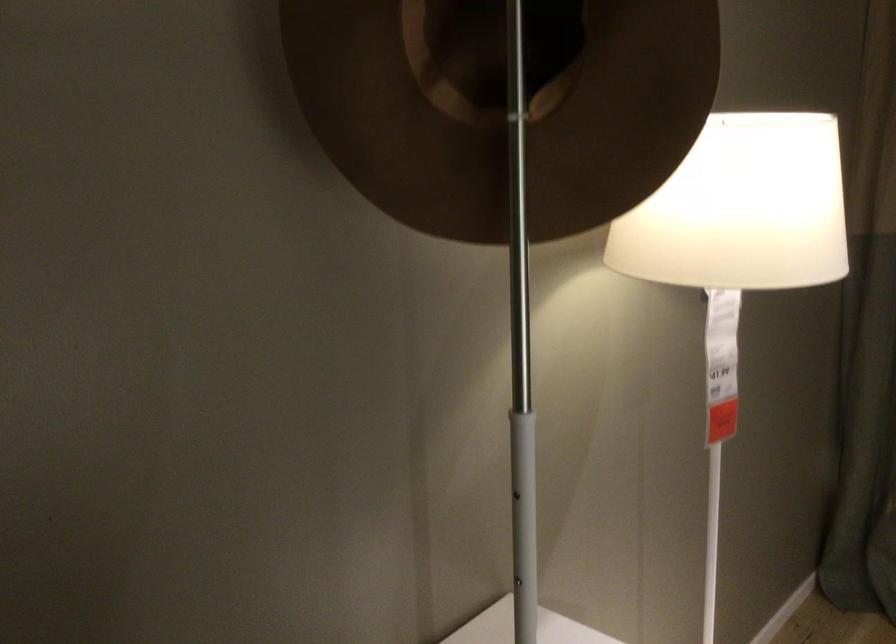
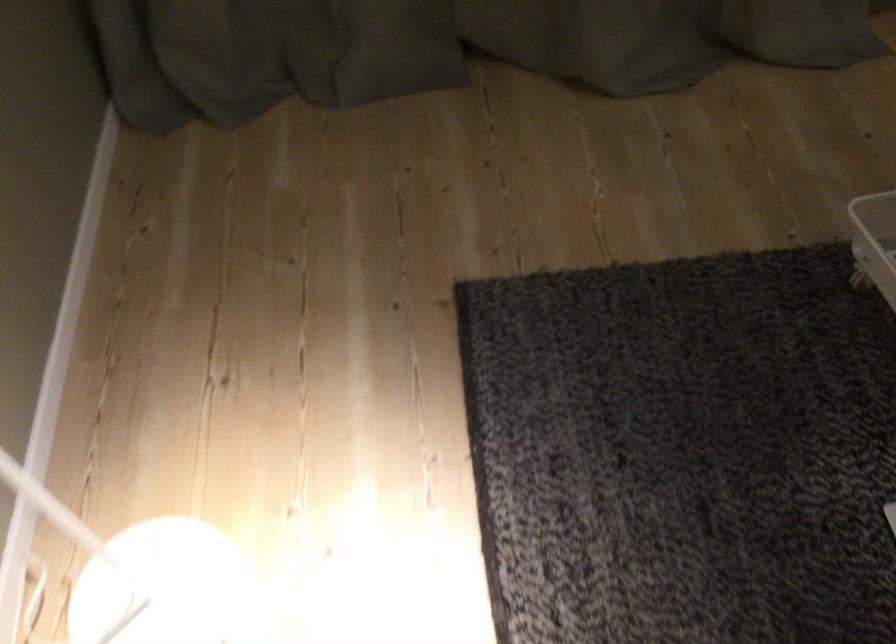
The images are taken continuously from a first-person perspective. In which direction is your viewpoint rotating?

The camera's rotation is toward right-down.